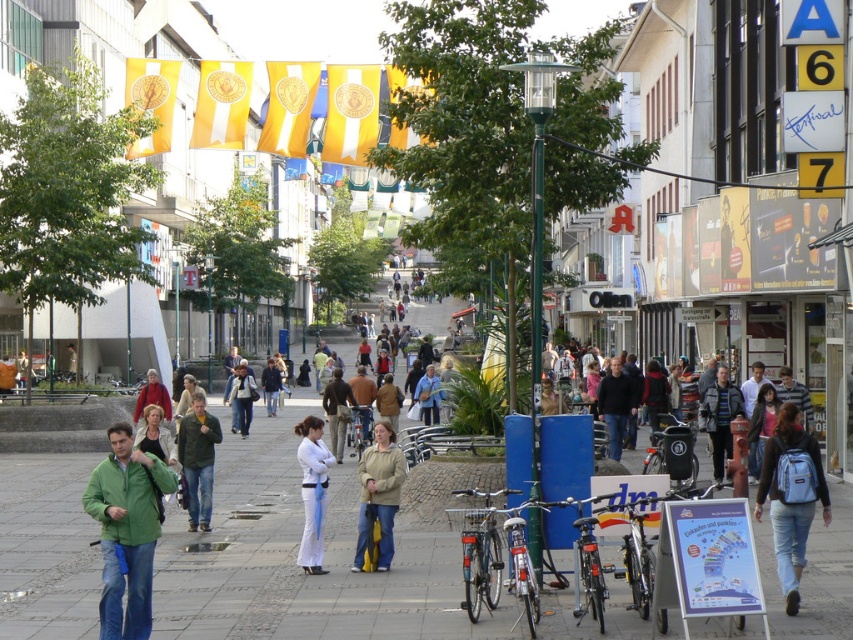
Between white matte pants at center and green fabric jacket at center, which one is positioned lower?

white matte pants at center is lower down.

Measure the distance between white matte pants at center and camera.

white matte pants at center is 22.41 meters away from camera.

The image size is (853, 640). Identify the location of white matte pants at center. (312, 492).

In the scene shown: Which of these two, blue backpack at lower right or white matte pants at center, stands taller?

With more height is blue backpack at lower right.

The image size is (853, 640). Identify the location of blue backpack at lower right. (790, 500).

Can you confirm if green fabric jacket at center is smaller than dark blue jacket at center?

Yes, green fabric jacket at center is smaller than dark blue jacket at center.

Can you confirm if green fabric jacket at center is wider than dark blue jacket at center?

No.

Does point (189, 522) come behind point (265, 378)?

No, (189, 522) is closer to viewer.

Locate an element on the screen. green fabric jacket at center is located at coordinates (198, 460).